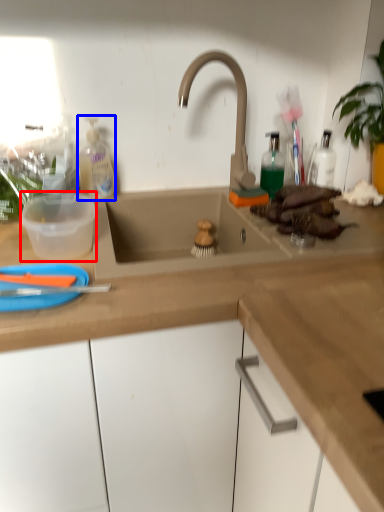
Question: Which object is closer to the camera taking this photo, basin (highlighted by a red box) or cleaning product (highlighted by a blue box)?

Choices:
 (A) basin
 (B) cleaning product

Answer: (A)